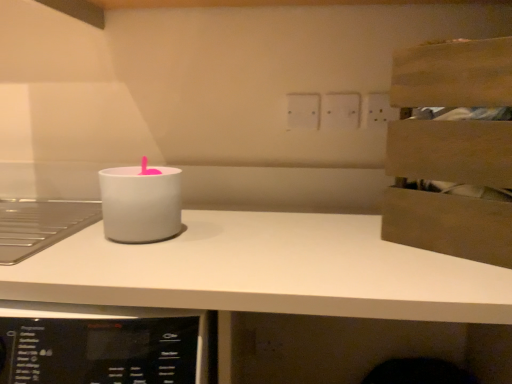
The width and height of the screenshot is (512, 384). I want to click on vacant region to the right of white matte candle holder at center, so click(207, 231).